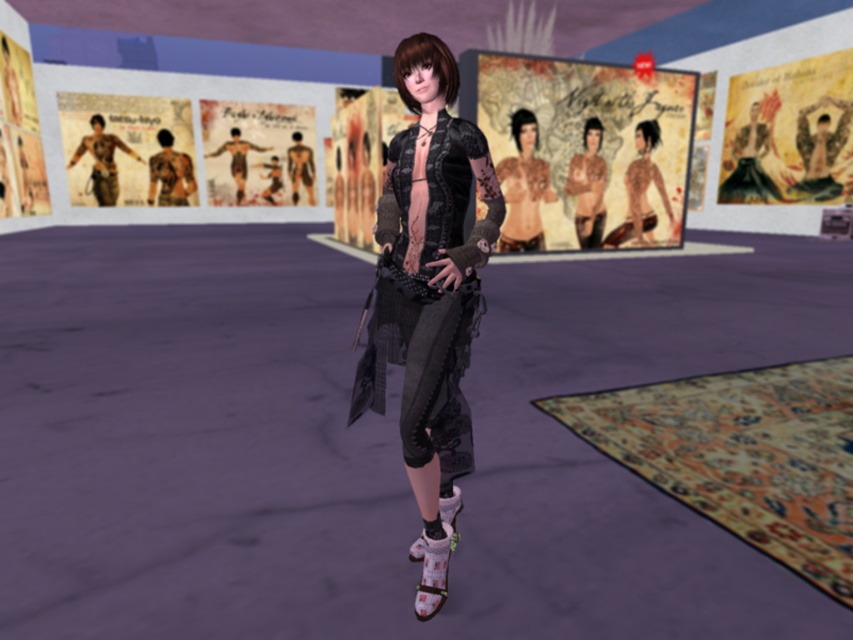
Based on the photo, you are an artist in the gallery trying to hang a new painting. You notice the matte paper poster at upper center and the matte black top at center. Which object is located above the other?

The matte paper poster at upper center is positioned over the matte black top at center, meaning it is above the other object.